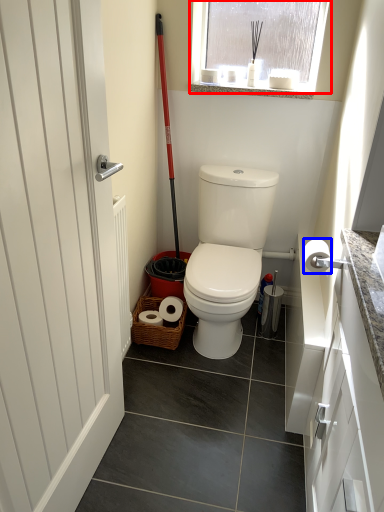
Question: Which of the following is the farthest to the observer, window (highlighted by a red box) or toilet paper (highlighted by a blue box)?

Choices:
 (A) window
 (B) toilet paper

Answer: (A)